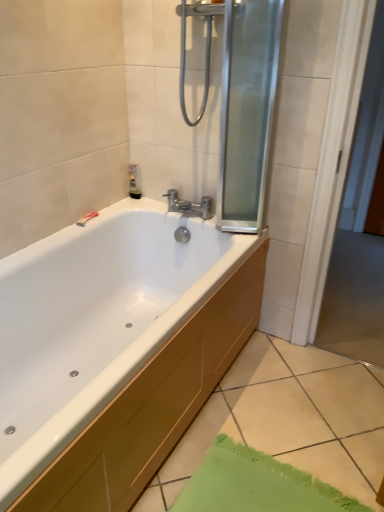
Question: Is translucent plastic tube at upper left to the left of white glossy bathtub at lower left from the viewer's perspective?

Choices:
 (A) yes
 (B) no

Answer: (A)

Question: Is translucent plastic tube at upper left far away from white glossy bathtub at lower left?

Choices:
 (A) no
 (B) yes

Answer: (A)

Question: From a real-world perspective, does translucent plastic tube at upper left sit lower than white glossy bathtub at lower left?

Choices:
 (A) yes
 (B) no

Answer: (B)

Question: Does translucent plastic tube at upper left have a greater width compared to white glossy bathtub at lower left?

Choices:
 (A) no
 (B) yes

Answer: (A)

Question: Is the depth of translucent plastic tube at upper left greater than that of white glossy bathtub at lower left?

Choices:
 (A) no
 (B) yes

Answer: (B)

Question: Is translucent plastic tube at upper left thinner than white glossy bathtub at lower left?

Choices:
 (A) yes
 (B) no

Answer: (A)

Question: From the image's perspective, is translucent plastic tube at upper left on chrome metallic faucet at center?

Choices:
 (A) no
 (B) yes

Answer: (B)

Question: Is translucent plastic tube at upper left bigger than chrome metallic faucet at center?

Choices:
 (A) no
 (B) yes

Answer: (A)

Question: Is translucent plastic tube at upper left closer to camera compared to chrome metallic faucet at center?

Choices:
 (A) yes
 (B) no

Answer: (B)

Question: Considering the relative sizes of translucent plastic tube at upper left and chrome metallic faucet at center in the image provided, is translucent plastic tube at upper left wider than chrome metallic faucet at center?

Choices:
 (A) yes
 (B) no

Answer: (B)

Question: Is translucent plastic tube at upper left positioned beyond the bounds of chrome metallic faucet at center?

Choices:
 (A) yes
 (B) no

Answer: (A)

Question: Could you tell me if translucent plastic tube at upper left is facing chrome metallic faucet at center?

Choices:
 (A) yes
 (B) no

Answer: (A)

Question: From the image's perspective, would you say transparent glass screen door at upper right is shown under translucent plastic tube at upper left?

Choices:
 (A) yes
 (B) no

Answer: (B)